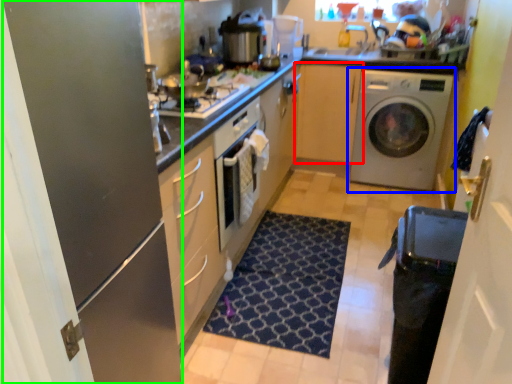
Question: Estimate the real-world distances between objects in this image. Which object is closer to cabinetry (highlighted by a red box), washing machine (highlighted by a blue box) or glass door (highlighted by a green box)?

Choices:
 (A) washing machine
 (B) glass door

Answer: (A)